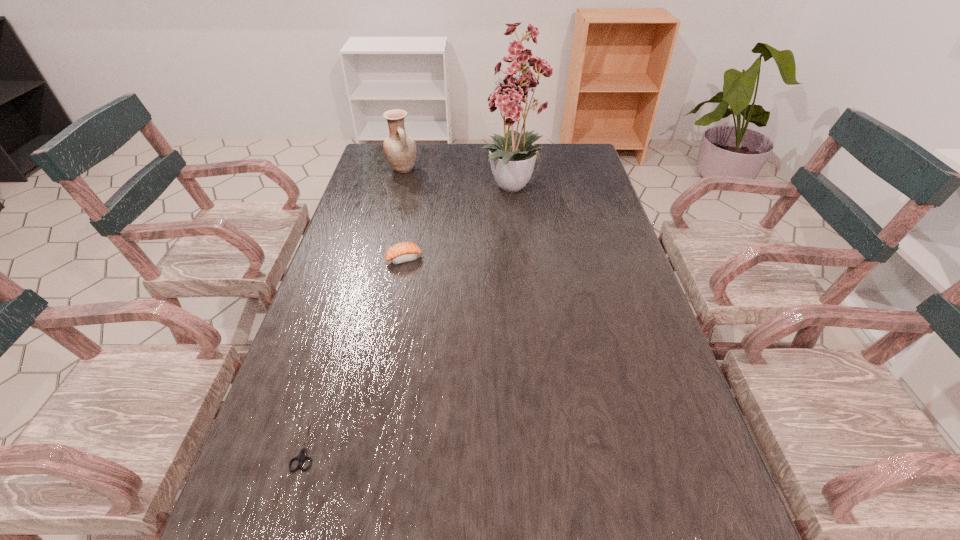
Locate an element on the screen. The height and width of the screenshot is (540, 960). vacant area that lies between the third farthest object and the taller shears is located at coordinates (355, 350).

I want to click on vacant area between the fourth shortest object and the taller shears, so click(355, 306).

Image resolution: width=960 pixels, height=540 pixels. Find the location of `vacant space that's between the third shortest object and the tallest object`. vacant space that's between the third shortest object and the tallest object is located at coordinates (460, 224).

At what (x,y) coordinates should I click in order to perform the action: click on vacant point located between the pottery and the taller shears. Please return your answer as a coordinate pair (x, y). The height and width of the screenshot is (540, 960). Looking at the image, I should click on (355, 306).

Find the location of a particular element. Image resolution: width=960 pixels, height=540 pixels. free space between the second tallest object and the second shortest object is located at coordinates (355, 306).

This screenshot has width=960, height=540. I want to click on vacant area that lies between the third tallest object and the flower arrangement, so click(460, 224).

I want to click on free space between the pottery and the third farthest object, so click(403, 214).

Locate an element on the screen. This screenshot has width=960, height=540. the second closest object to the sushi is located at coordinates (400, 149).

Identify which object is the fourth nearest to the shorter shears. Please provide its 2D coordinates. Your answer should be formatted as a tuple, i.e. [(x, y)], where the tuple contains the x and y coordinates of a point satisfying the conditions above.

[(400, 149)]